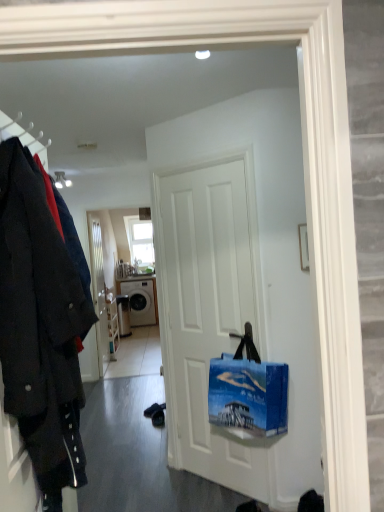
Question: From the image's perspective, would you say dark wool coat at left is shown under white glossy washing machine at center?

Choices:
 (A) yes
 (B) no

Answer: (B)

Question: Is the surface of dark wool coat at left in direct contact with white glossy washing machine at center?

Choices:
 (A) no
 (B) yes

Answer: (A)

Question: Is dark wool coat at left facing away from white glossy washing machine at center?

Choices:
 (A) yes
 (B) no

Answer: (B)

Question: Is dark wool coat at left at the left side of white glossy washing machine at center?

Choices:
 (A) yes
 (B) no

Answer: (B)

Question: From the image's perspective, does dark wool coat at left appear higher than white glossy washing machine at center?

Choices:
 (A) yes
 (B) no

Answer: (A)

Question: In terms of width, does white glossy washing machine at center look wider or thinner when compared to dark wool coat at left?

Choices:
 (A) wide
 (B) thin

Answer: (A)

Question: From the image's perspective, is white glossy washing machine at center located above or below dark wool coat at left?

Choices:
 (A) below
 (B) above

Answer: (A)

Question: Is white glossy washing machine at center inside the boundaries of dark wool coat at left, or outside?

Choices:
 (A) outside
 (B) inside

Answer: (A)

Question: In terms of height, does white glossy washing machine at center look taller or shorter compared to dark wool coat at left?

Choices:
 (A) tall
 (B) short

Answer: (B)

Question: In terms of width, does white glossy washing machine at center look wider or thinner when compared to clear glass window at upper center?

Choices:
 (A) wide
 (B) thin

Answer: (A)

Question: Is white glossy washing machine at center taller or shorter than clear glass window at upper center?

Choices:
 (A) short
 (B) tall

Answer: (A)

Question: Visually, is white glossy washing machine at center positioned to the left or to the right of clear glass window at upper center?

Choices:
 (A) right
 (B) left

Answer: (A)

Question: Choose the correct answer: Is white glossy washing machine at center inside clear glass window at upper center or outside it?

Choices:
 (A) inside
 (B) outside

Answer: (B)

Question: Based on their positions, is dark wool coat at left located to the left or right of white matte door at center, the second door when ordered from left to right?

Choices:
 (A) right
 (B) left

Answer: (B)

Question: From a real-world perspective, relative to white matte door at center, acting as the 1th door starting from the front, is dark wool coat at left vertically above or below?

Choices:
 (A) below
 (B) above

Answer: (B)